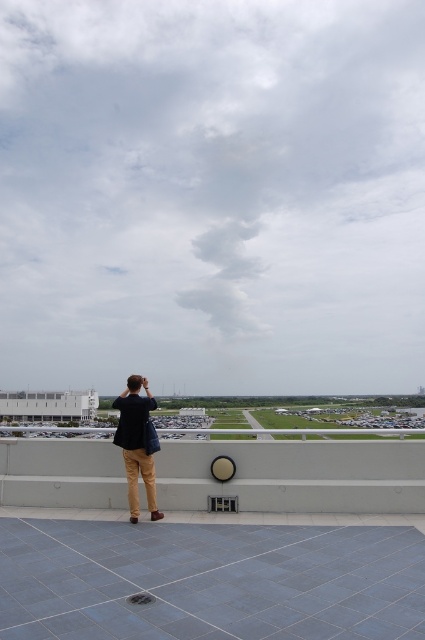
Is point (408, 481) farther from camera compared to point (127, 410)?

That is True.

Is gray concrete ledge at lower center behind dark blue shirt at center?

Yes, it is.

Does point (323, 440) lie in front of point (116, 435)?

That is False.

Find the location of `gray concrete ledge at lower center`. gray concrete ledge at lower center is located at coordinates (297, 476).